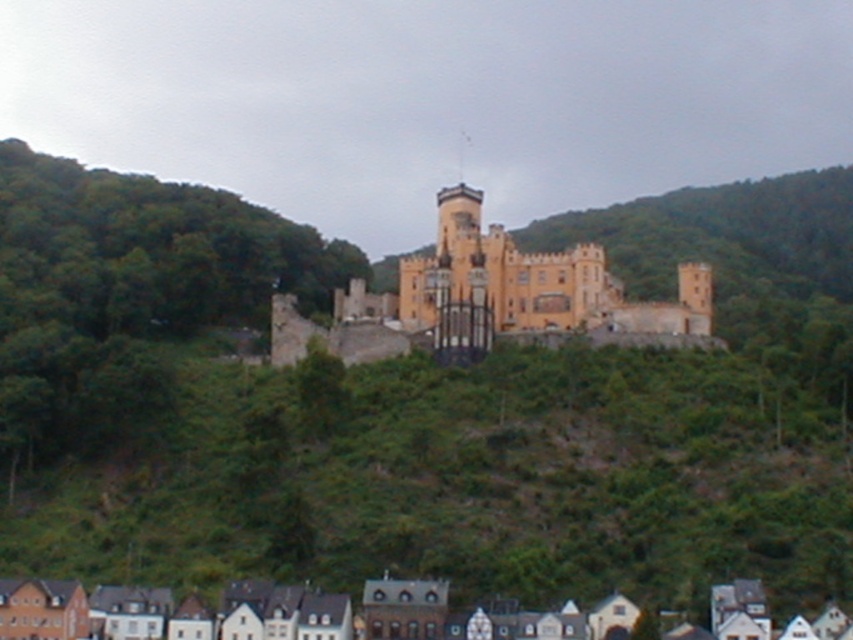
Does matte orange stone castle at center have a larger size compared to white painted wood houses at lower center?

Yes, matte orange stone castle at center is bigger than white painted wood houses at lower center.

How far apart are matte orange stone castle at center and white painted wood houses at lower center?

matte orange stone castle at center and white painted wood houses at lower center are 186.51 feet apart.

In order to click on matte orange stone castle at center in this screenshot , I will do pyautogui.click(x=494, y=300).